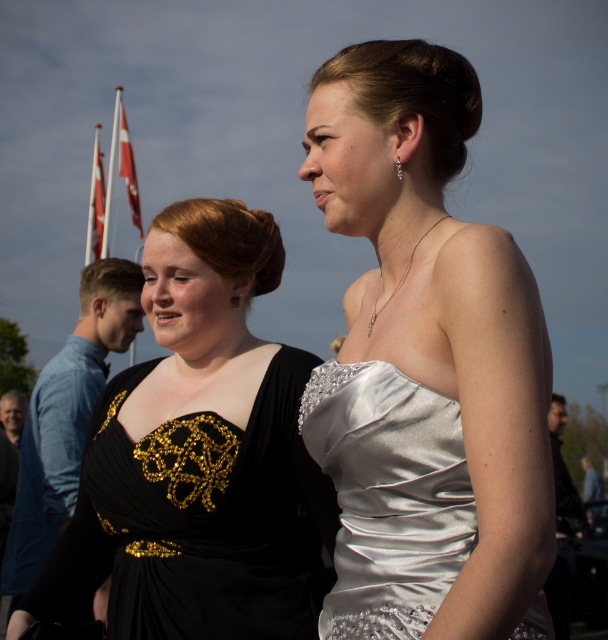
Is satin dress at upper right smaller than satin dress at center?

No.

Does point (423, 52) come farther from viewer compared to point (395, 536)?

Yes.

Which is behind, point (443, 545) or point (339, 500)?

The point (339, 500) is behind.

Where is `satin dress at upper right`? The image size is (608, 640). satin dress at upper right is located at coordinates coord(426,365).

Does black satin dress at center have a smaller size compared to red fabric flag at upper left?

Actually, black satin dress at center might be larger than red fabric flag at upper left.

Between black satin dress at center and red fabric flag at upper left, which one is positioned lower?

black satin dress at center

Measure the distance between point (19,627) and camera.

They are 13.33 feet apart.

Identify the location of black satin dress at center. pos(198,456).

Can you confirm if satin dress at upper right is thinner than white fabric flag at upper left?

Yes, satin dress at upper right is thinner than white fabric flag at upper left.

Which is more to the right, satin dress at upper right or white fabric flag at upper left?

Positioned to the right is satin dress at upper right.

Between point (420, 209) and point (97, 179), which one is positioned behind?

The point (97, 179) is more distant.

This screenshot has width=608, height=640. I want to click on satin dress at upper right, so click(x=426, y=365).